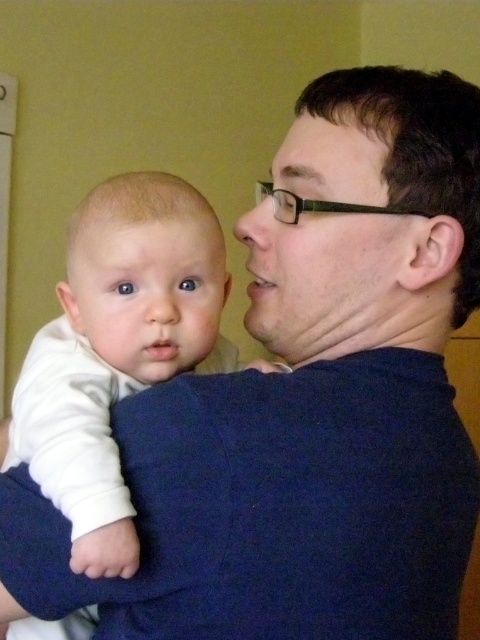
Question: Which object appears farthest from the camera in this image?

Choices:
 (A) white soft baby at left
 (B) smooth white baby at center

Answer: (B)

Question: Is white soft baby at left positioned before matte black face at center?

Choices:
 (A) yes
 (B) no

Answer: (A)

Question: Is white soft baby at left above smooth white baby at center?

Choices:
 (A) yes
 (B) no

Answer: (B)

Question: Which object is the farthest from the matte black face at center?

Choices:
 (A) smooth white baby at center
 (B) white soft baby at left

Answer: (B)

Question: Can you confirm if matte black face at center is smaller than smooth white baby at center?

Choices:
 (A) yes
 (B) no

Answer: (B)

Question: Which of the following is the farthest from the observer?

Choices:
 (A) smooth white baby at center
 (B) matte black face at center

Answer: (A)